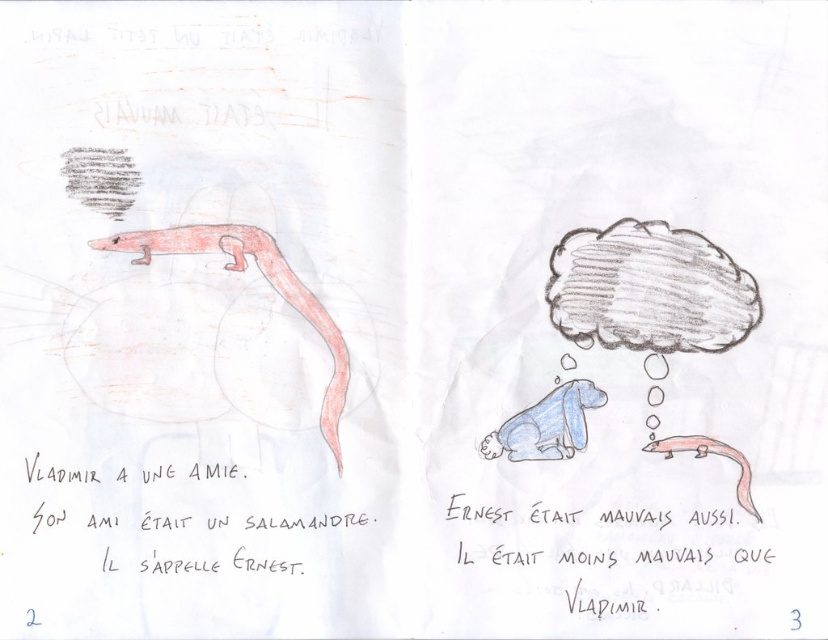
From the picture: What is the relationship between the sizes of the pink matte salamander at center and the matte pink salamander at lower right?

The pink matte salamander at center is wider than the matte pink salamander at lower right.